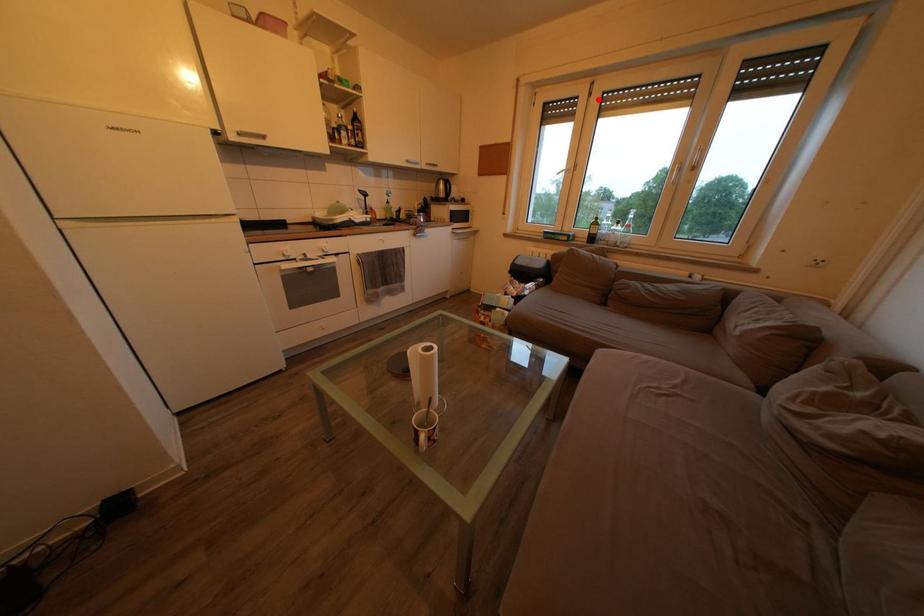
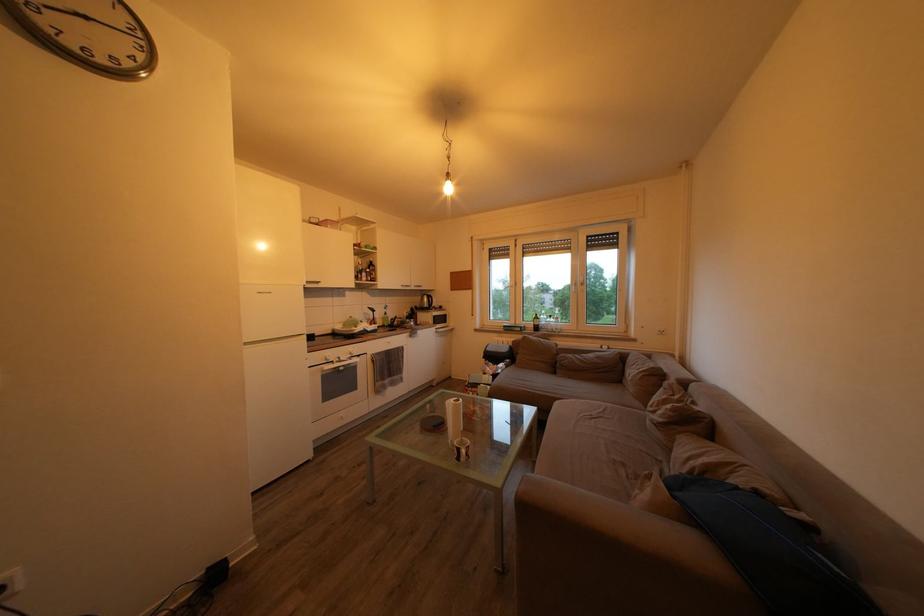
The point at the highlighted location is marked in the first image. Where is the corresponding point in the second image?

(524, 252)